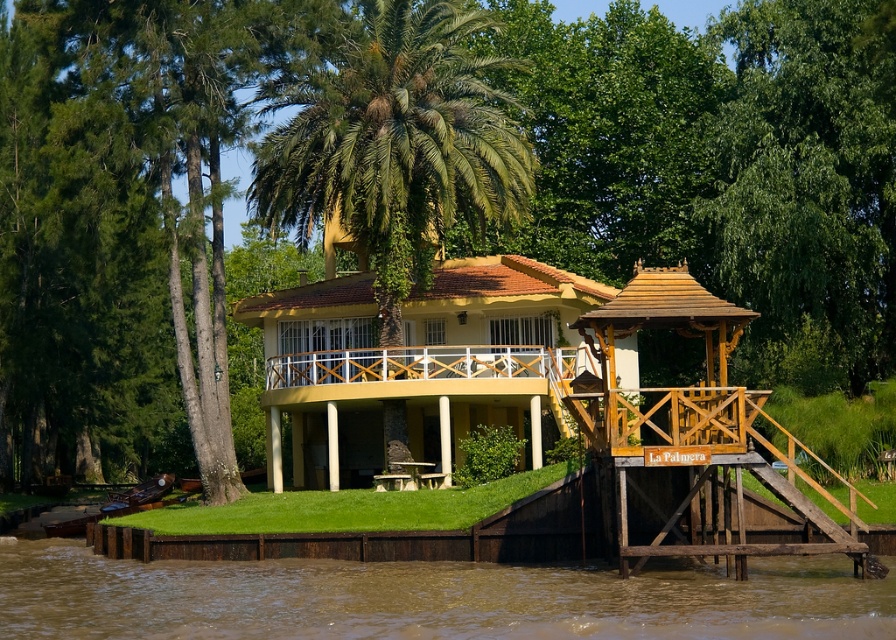
Question: Based on their relative distances, which object is farther from the white wood railing at center?

Choices:
 (A) green leafy palm tree at center
 (B) brown muddy water at lower left

Answer: (B)

Question: Is brown muddy water at lower left wider than green leafy palm tree at center?

Choices:
 (A) yes
 (B) no

Answer: (A)

Question: Which point is farther to the camera?

Choices:
 (A) (506, 131)
 (B) (660, 413)

Answer: (A)

Question: Can you confirm if brown muddy water at lower left is smaller than green leafy palm tree at center?

Choices:
 (A) no
 (B) yes

Answer: (B)

Question: Is green leafy palm tree at center smaller than wooden gazebo at right?

Choices:
 (A) no
 (B) yes

Answer: (A)

Question: Which object is closer to the camera taking this photo?

Choices:
 (A) green leafy palm tree at center
 (B) brown muddy water at lower left
 (C) white wood railing at center
 (D) wooden gazebo at right

Answer: (B)